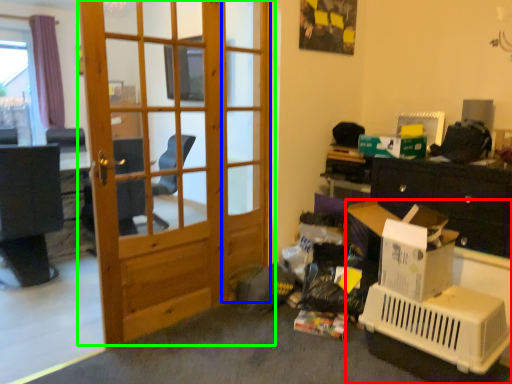
Question: Estimate the real-world distances between objects in this image. Which object is closer to desk (highlighted by a red box), screen door (highlighted by a blue box) or door (highlighted by a green box)?

Choices:
 (A) screen door
 (B) door

Answer: (A)